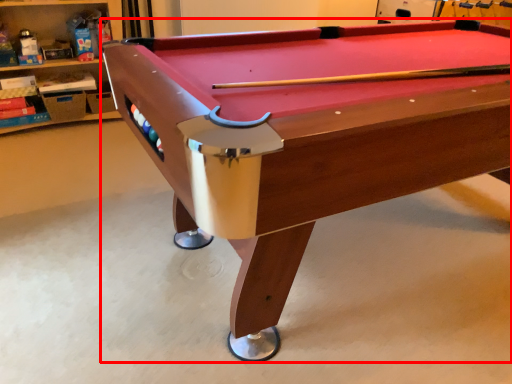
Question: Where is billiard table (annotated by the red box) located in relation to shelf in the image?

Choices:
 (A) left
 (B) right

Answer: (B)